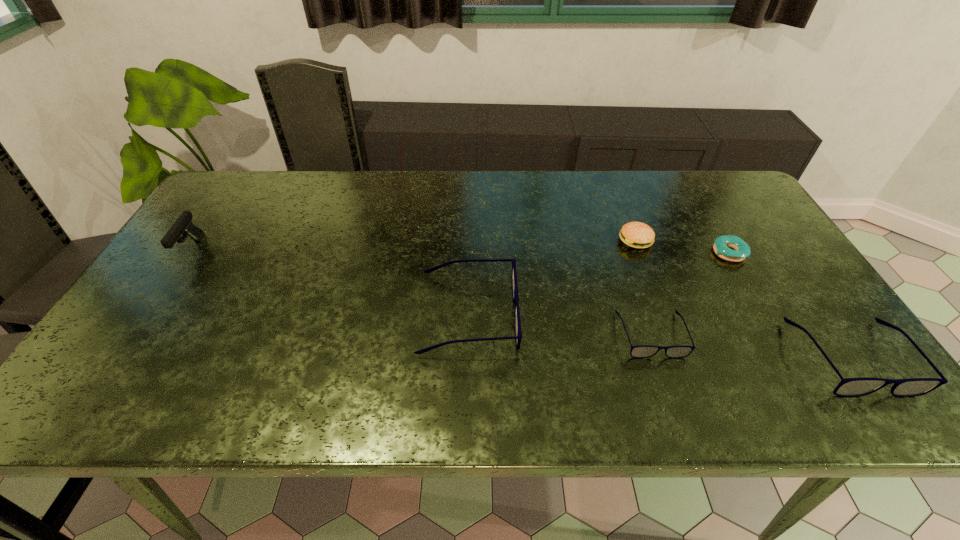
Where is `vacant position located on the front of the patty`? Image resolution: width=960 pixels, height=540 pixels. vacant position located on the front of the patty is located at coordinates (673, 341).

I want to click on object that is at the left edge, so click(183, 225).

Where is `spectacles that is positioned at the right edge`? This screenshot has height=540, width=960. spectacles that is positioned at the right edge is located at coordinates (848, 387).

At what (x,y) coordinates should I click in order to perform the action: click on doughnut positioned at the right edge. Please return your answer as a coordinate pair (x, y). Image resolution: width=960 pixels, height=540 pixels. Looking at the image, I should click on (722, 245).

You are a GUI agent. You are given a task and a screenshot of the screen. Output one action in this format:
    pyautogui.click(x=<x>, y=<y>)
    Task: Click on the object that is positioned at the near right corner
    The image size is (960, 540).
    Given the screenshot: What is the action you would take?
    pyautogui.click(x=848, y=387)

Where is `vacant space at the far edge`? The image size is (960, 540). vacant space at the far edge is located at coordinates 598,207.

The image size is (960, 540). I want to click on blank space at the near edge of the desktop, so click(x=591, y=345).

This screenshot has width=960, height=540. I want to click on free region at the left edge of the desktop, so click(x=141, y=336).

In the image, there is a desktop. Where is `vacant space at the right edge`? The width and height of the screenshot is (960, 540). vacant space at the right edge is located at coordinates (758, 241).

Where is `free space that is in between the pistol and the shortest spectacles`? free space that is in between the pistol and the shortest spectacles is located at coordinates (421, 292).